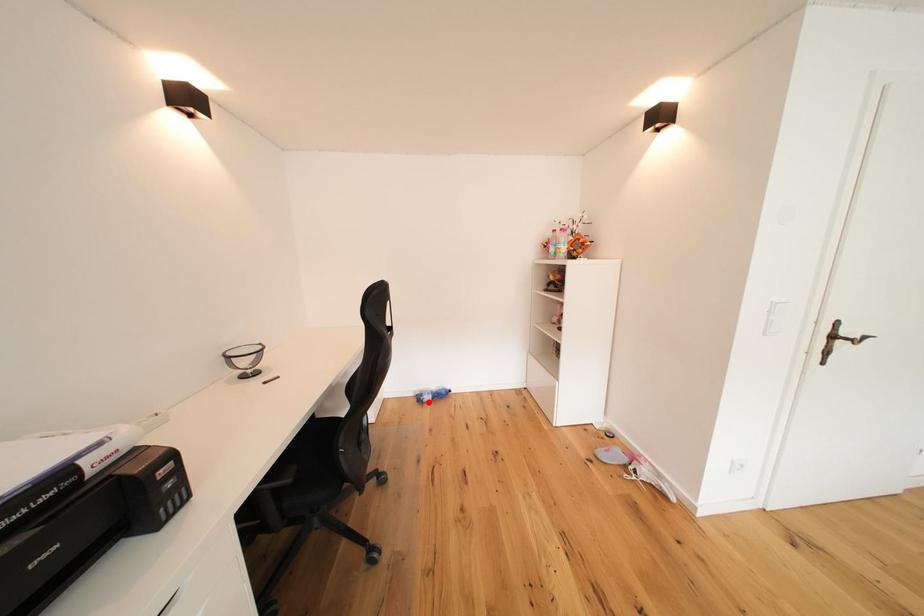
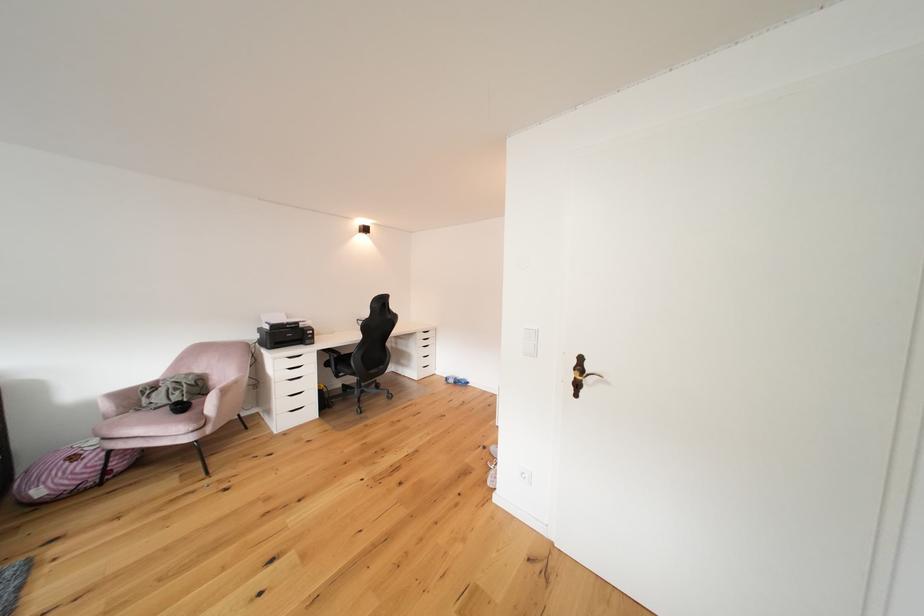
Find the pixel in the second image that matches the highlighted location in the first image.

(456, 383)